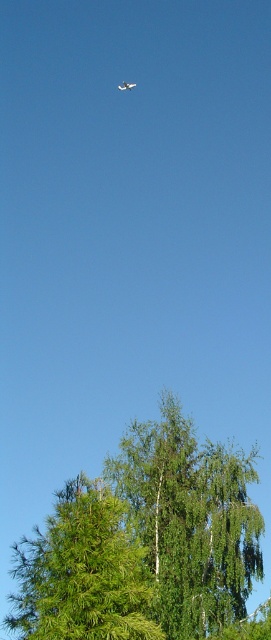
Does point (30, 637) come behind point (124, 81)?

No, it is not.

How much distance is there between green leafy tree at lower center and metallic silver airplane at upper center?

The distance of green leafy tree at lower center from metallic silver airplane at upper center is 186.00 feet.

Between point (75, 524) and point (124, 83), which one is positioned behind?

The point (124, 83) is behind.

Image resolution: width=271 pixels, height=640 pixels. Find the location of `green leafy tree at lower center`. green leafy tree at lower center is located at coordinates (82, 572).

Does point (198, 632) come in front of point (131, 83)?

Yes, point (198, 632) is closer to viewer.

Is point (179, 605) positioned behind point (130, 83)?

No, (179, 605) is closer to viewer.

Between point (201, 464) and point (117, 86), which one is positioned in front?

Point (201, 464) is more forward.

Locate an element on the screen. green leafy tree at center is located at coordinates (191, 520).

Is green leafy tree at center thinner than green leafy tree at lower center?

In fact, green leafy tree at center might be wider than green leafy tree at lower center.

Can you confirm if green leafy tree at center is positioned above green leafy tree at lower center?

Correct, green leafy tree at center is located above green leafy tree at lower center.

Is point (223, 554) closer to viewer compared to point (140, 637)?

No, (223, 554) is behind (140, 637).

This screenshot has width=271, height=640. I want to click on green leafy tree at center, so click(x=191, y=520).